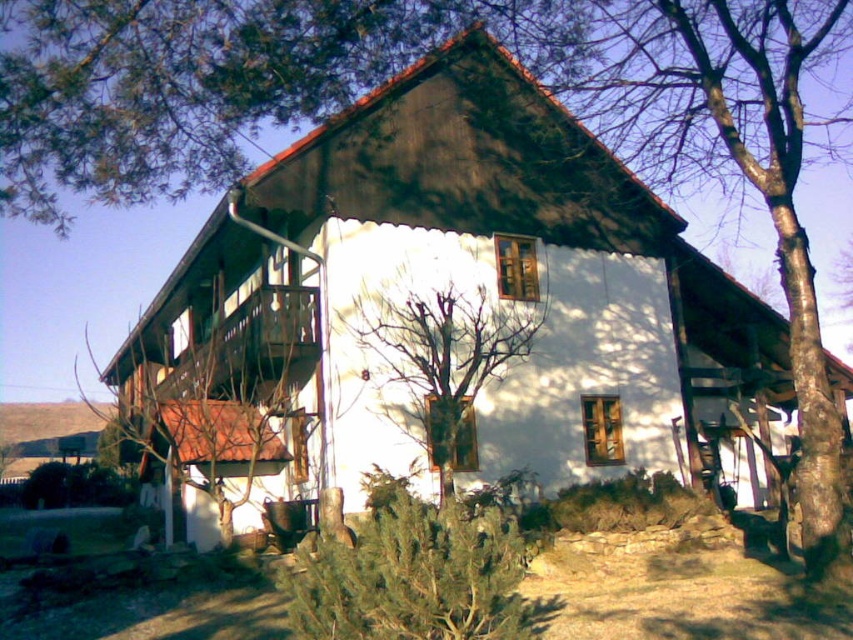
You are a gardener standing at the edge of the property and need to trim the bare branches at center near the white matte house at center. Given that your ladder is 2.8 meters tall, will it reach the branches if you place it against the house?

The white matte house at center is 2.93 meters from the bare branches at center. Since the ladder is only 2.8 meters tall, it will be 0.13 meters too short to reach the branches when placed against the house.

You are standing in front of the house and want to walk towards the green textured bush at lower center and the bare branches at center. Which one would you need to walk towards first to reach the one closer to you?

The green textured bush at lower center is closer to the viewer than the bare branches at center, so you would first walk towards the green textured bush at lower center since it is already closer to you.

You are standing in front of the house and want to hang a bird feeder from the branches. Based on the image, can you determine if the bare branches at center are above or below the white matte house at center?

The white matte house at center is below the bare branches at center, so the branches are above the house.